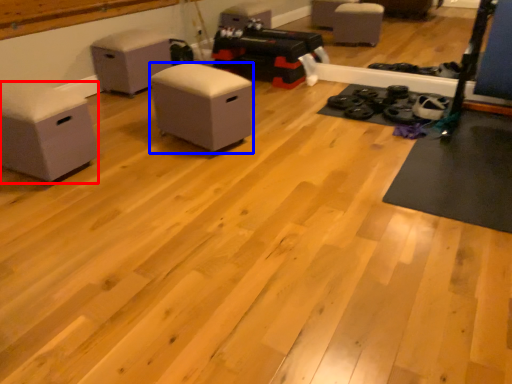
Question: Which object is further to the camera taking this photo, furniture (highlighted by a red box) or furniture (highlighted by a blue box)?

Choices:
 (A) furniture
 (B) furniture

Answer: (B)